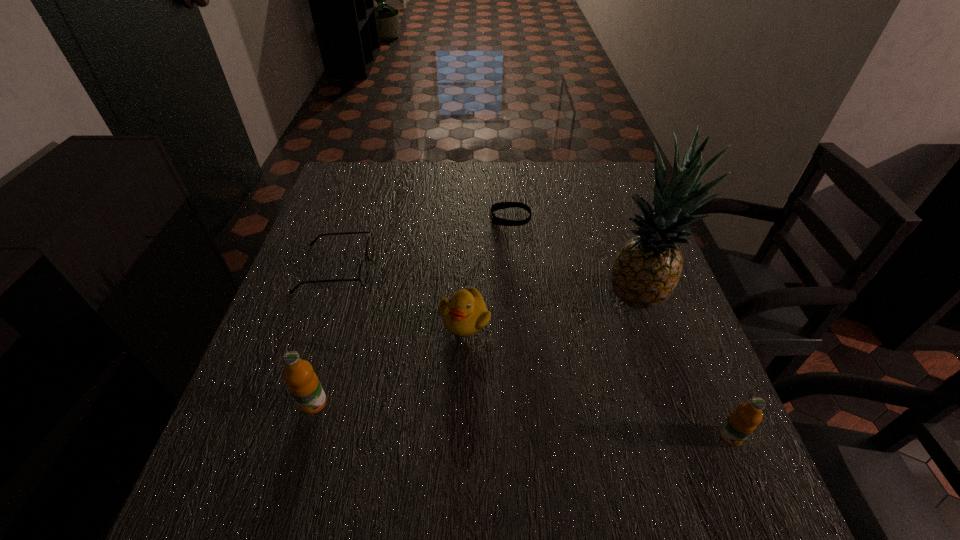
Where is `free space located 0.070m on the label of the taller orange juice`? This screenshot has width=960, height=540. free space located 0.070m on the label of the taller orange juice is located at coordinates (299, 453).

This screenshot has width=960, height=540. Identify the location of blank area located 0.110m on the display of the wristband. (450, 218).

The width and height of the screenshot is (960, 540). What are the coordinates of `vacant space located 0.240m on the display of the wristband` in the screenshot? It's located at (404, 218).

The height and width of the screenshot is (540, 960). Identify the location of vacant position located on the display of the wristband. (404, 218).

Locate an element on the screen. The width and height of the screenshot is (960, 540). free space located on the front of the tallest object is located at coordinates (672, 392).

Identify the location of vacant space located 0.090m on the front-facing side of the duckling. The width and height of the screenshot is (960, 540). (463, 375).

Identify the location of vacant position located 0.200m on the front-facing side of the spectacles. The image size is (960, 540). (451, 269).

The width and height of the screenshot is (960, 540). Identify the location of orange juice located at the left edge. (303, 383).

Locate an element on the screen. spectacles that is at the left edge is located at coordinates (363, 272).

At what (x,y) coordinates should I click in order to perform the action: click on orange juice that is at the right edge. Please return your answer as a coordinate pair (x, y). Image resolution: width=960 pixels, height=540 pixels. Looking at the image, I should click on (742, 422).